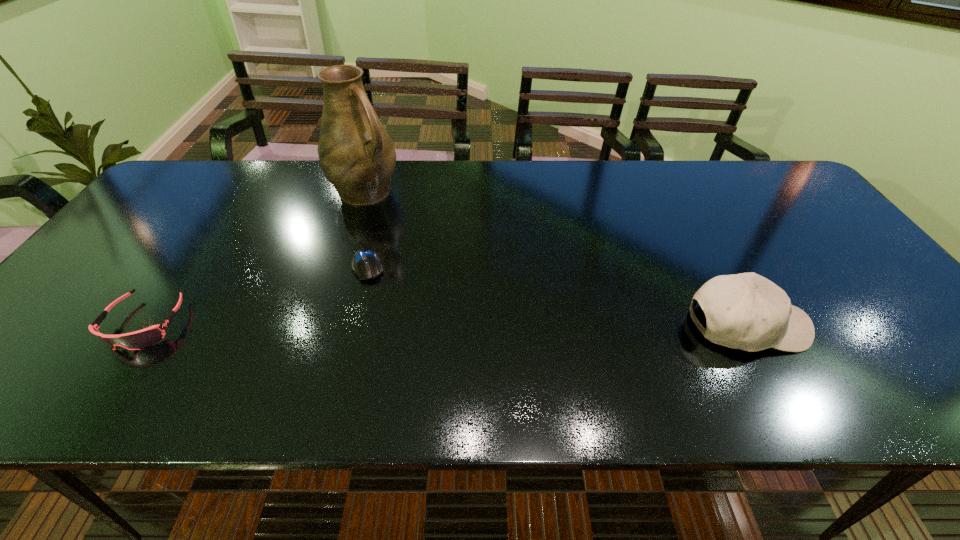
I want to click on free spot on the desktop that is between the second shortest object and the baseball cap and is positioned on the handle side of the tallest object, so click(532, 325).

Find the location of `free space on the desktop that is between the second shortest object and the rightmost object and is positioned on the button side of the computer mouse`. free space on the desktop that is between the second shortest object and the rightmost object and is positioned on the button side of the computer mouse is located at coordinates (384, 324).